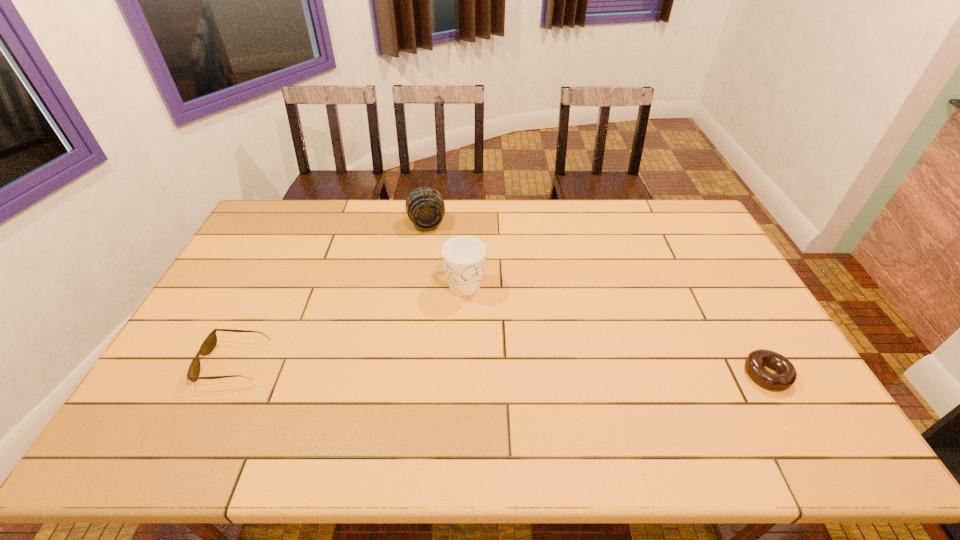
Locate an element on the screen. The height and width of the screenshot is (540, 960). sunglasses is located at coordinates (208, 345).

What are the coordinates of `doughnut` in the screenshot? It's located at (786, 375).

Locate an element on the screen. This screenshot has height=540, width=960. mug is located at coordinates (463, 257).

Where is `the third object from left to right`? This screenshot has height=540, width=960. the third object from left to right is located at coordinates tap(463, 257).

Find the location of a particular element. the third object from right to left is located at coordinates (425, 207).

Locate an element on the screen. the farthest object is located at coordinates (425, 207).

Where is `vacant space located on the lenses of the sunglasses`? This screenshot has height=540, width=960. vacant space located on the lenses of the sunglasses is located at coordinates (174, 363).

I want to click on vacant space located on the lenses of the sunglasses, so click(x=170, y=363).

Where is `vacant space located on the left of the doughnut`? The height and width of the screenshot is (540, 960). vacant space located on the left of the doughnut is located at coordinates (645, 374).

Identify the location of blank space located on the side of the third object from left to right with the handle. (514, 360).